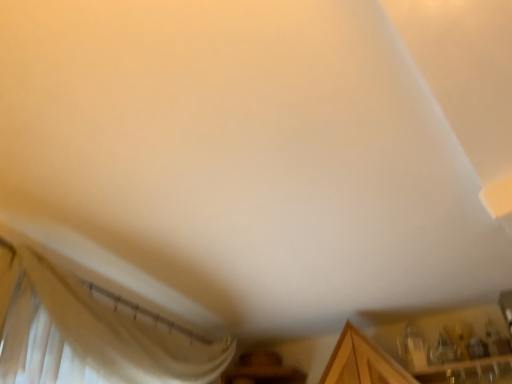
Question: From the image's perspective, would you say wooden cabinet at lower right is shown under white sheer curtain at lower left?

Choices:
 (A) yes
 (B) no

Answer: (A)

Question: Is wooden cabinet at lower right positioned with its back to white sheer curtain at lower left?

Choices:
 (A) no
 (B) yes

Answer: (A)

Question: From a real-world perspective, is wooden cabinet at lower right under white sheer curtain at lower left?

Choices:
 (A) yes
 (B) no

Answer: (B)

Question: From the image's perspective, would you say wooden cabinet at lower right is positioned over white sheer curtain at lower left?

Choices:
 (A) yes
 (B) no

Answer: (B)

Question: Is wooden cabinet at lower right not within white sheer curtain at lower left?

Choices:
 (A) no
 (B) yes

Answer: (B)

Question: Does wooden cabinet at lower right turn towards white sheer curtain at lower left?

Choices:
 (A) no
 (B) yes

Answer: (A)

Question: Is the surface of white sheer curtain at lower left in direct contact with wooden cabinet at lower right?

Choices:
 (A) no
 (B) yes

Answer: (A)

Question: Can you confirm if white sheer curtain at lower left is shorter than wooden cabinet at lower right?

Choices:
 (A) yes
 (B) no

Answer: (B)

Question: From a real-world perspective, does white sheer curtain at lower left sit lower than wooden cabinet at lower right?

Choices:
 (A) yes
 (B) no

Answer: (A)

Question: Considering the relative sizes of white sheer curtain at lower left and wooden cabinet at lower right in the image provided, is white sheer curtain at lower left wider than wooden cabinet at lower right?

Choices:
 (A) no
 (B) yes

Answer: (A)

Question: From a real-world perspective, is white sheer curtain at lower left over wooden cabinet at lower right?

Choices:
 (A) yes
 (B) no

Answer: (B)

Question: Is white sheer curtain at lower left not within wooden cabinet at lower right?

Choices:
 (A) yes
 (B) no

Answer: (A)

Question: Considering the positions of wooden cabinet at lower right and white sheer curtain at lower left in the image, is wooden cabinet at lower right wider or thinner than white sheer curtain at lower left?

Choices:
 (A) wide
 (B) thin

Answer: (A)